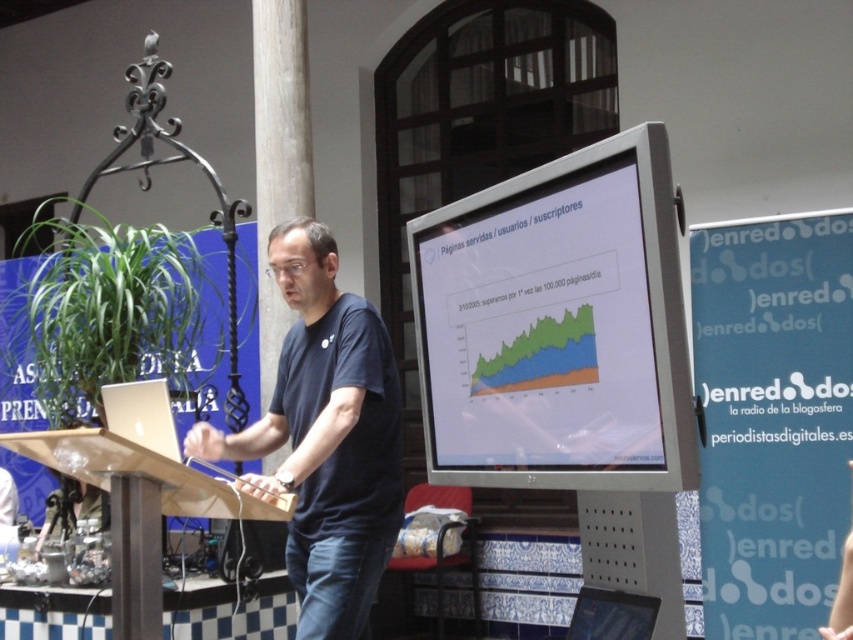
You are an event organizer who needs to adjust the seating arrangement for the audience. The venue has limited space, so you must determine which object, the matte plastic monitor at center or the wooden podium at center, takes up more vertical space to optimize seating. Which object is taller?

The matte plastic monitor at center is taller than the wooden podium at center, so it takes up more vertical space and should be considered when optimizing seating.

You are an attendee at the presentation. You want to know where the laptop is located relative to the monitor displayed at point (556, 326). Can you determine its position?

The laptop is placed on top of the matte plastic monitor at center located at point (556, 326).